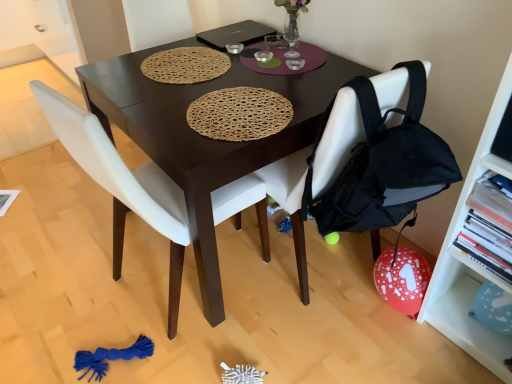
Identify the location of free spot in front of black fabric chair at center, the first chair when ordered from right to left. (318, 342).